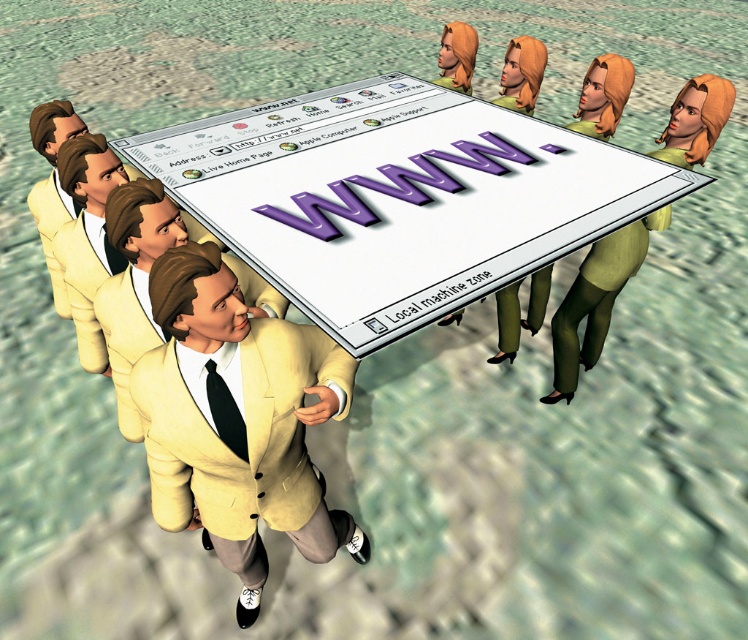
Question: Among these objects, which one is nearest to the camera?

Choices:
 (A) green matte dress at right
 (B) matte yellow suit at center
 (C) light yellow fabric business suit at lower left

Answer: (B)

Question: Is matte yellow suit at center to the left of green matte dress at right from the viewer's perspective?

Choices:
 (A) yes
 (B) no

Answer: (A)

Question: Is matte yellow suit at center above light yellow fabric business suit at lower left?

Choices:
 (A) no
 (B) yes

Answer: (A)

Question: Can you confirm if matte yellow suit at center is smaller than green matte dress at right?

Choices:
 (A) yes
 (B) no

Answer: (A)

Question: Which point is farther to the camera?

Choices:
 (A) matte yellow suit at center
 (B) green matte dress at right

Answer: (B)

Question: Which object appears farthest from the camera in this image?

Choices:
 (A) green matte dress at right
 (B) light yellow fabric business suit at lower left

Answer: (A)